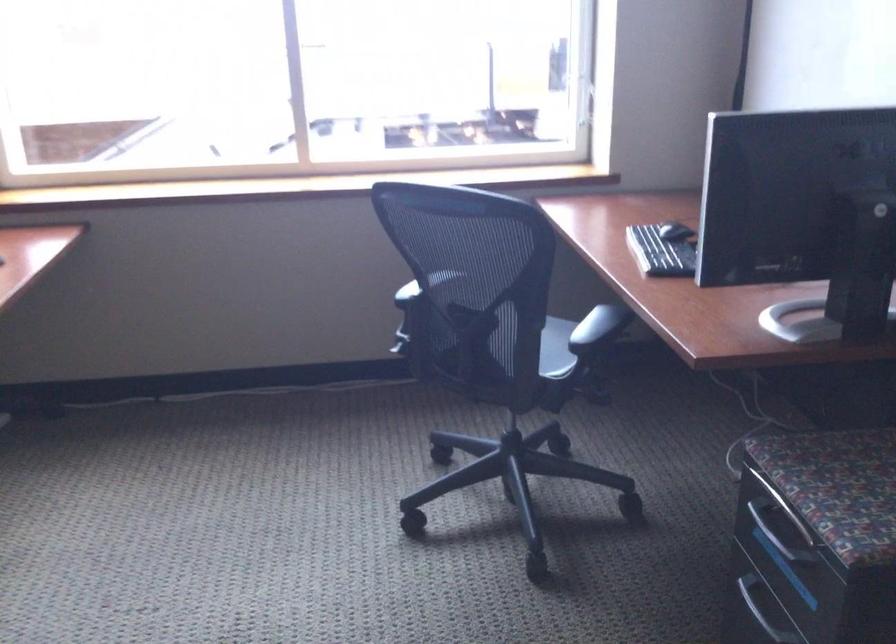
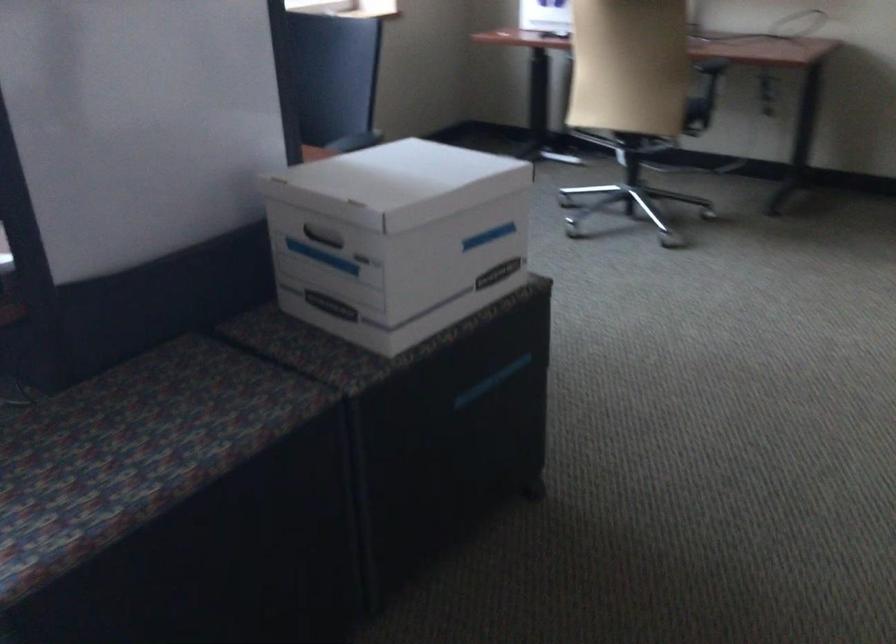
Question: The camera is either moving clockwise (left) or counter-clockwise (right) around the object. The first image is from the beginning of the video and the second image is from the end. Is the camera moving left or right when shooting the video?

Choices:
 (A) Left
 (B) Right

Answer: (A)